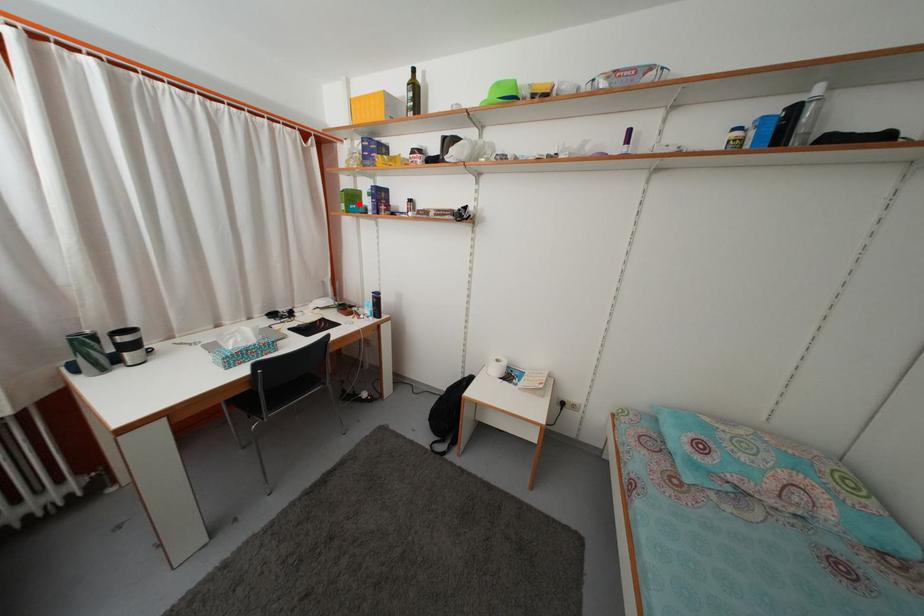
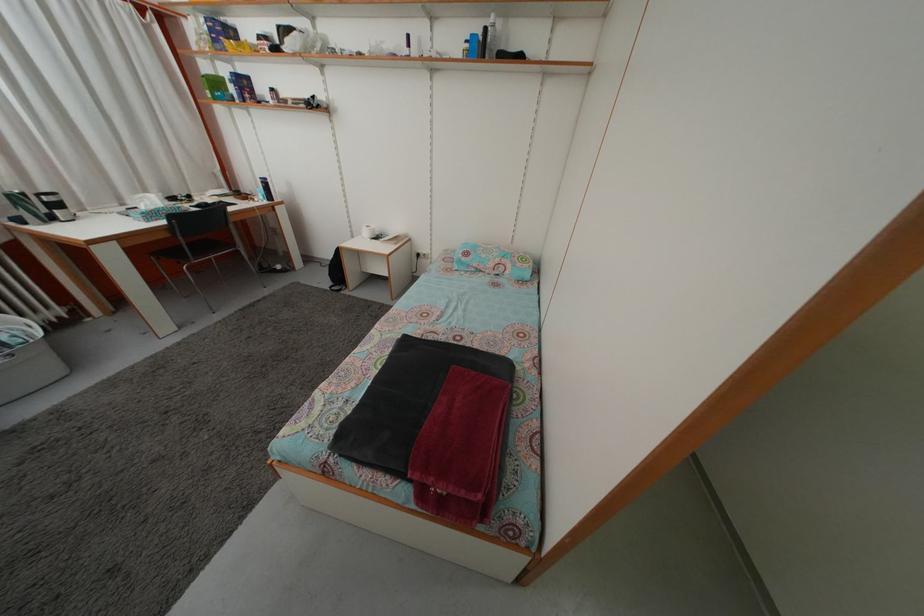
Locate, in the second image, the point that corresponds to the highlighted location in the first image.

(223, 91)